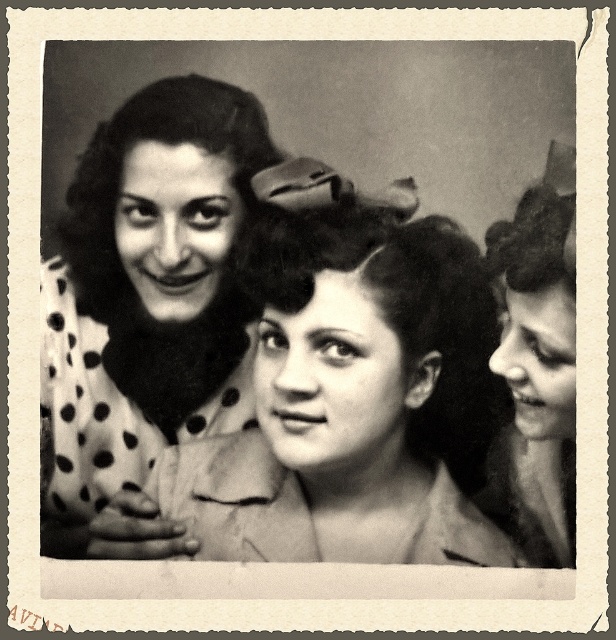
Can you confirm if polka dot fabric at center is thinner than curly dark hair at center?

Indeed, polka dot fabric at center has a lesser width compared to curly dark hair at center.

This screenshot has height=640, width=616. Describe the element at coordinates (145, 310) in the screenshot. I see `polka dot fabric at center` at that location.

Between point (168, 429) and point (488, 317), which one is positioned in front?

Positioned in front is point (488, 317).

Find the location of a particular element. polka dot fabric at center is located at coordinates (145, 310).

Between point (500, 419) and point (522, 544), which one is positioned in front?

Point (522, 544) is more forward.

How distant is curly dark hair at center from smooth skin face at right?

A distance of 3.38 inches exists between curly dark hair at center and smooth skin face at right.

This screenshot has height=640, width=616. In order to click on curly dark hair at center in this screenshot , I will do `click(397, 317)`.

Which is more to the right, polka dot fabric at center or smooth skin face at right?

From the viewer's perspective, smooth skin face at right appears more on the right side.

Image resolution: width=616 pixels, height=640 pixels. I want to click on polka dot fabric at center, so click(145, 310).

Does point (137, 280) come farther from viewer compared to point (530, 259)?

Yes, point (137, 280) is farther from viewer.

Where is `polka dot fabric at center`? Image resolution: width=616 pixels, height=640 pixels. polka dot fabric at center is located at coordinates (145, 310).